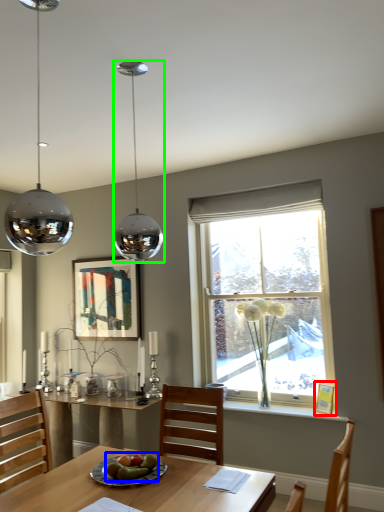
Question: Which is farther away from picture frame (highlighted by a red box)? food (highlighted by a blue box) or lamp (highlighted by a green box)?

Choices:
 (A) food
 (B) lamp

Answer: (B)